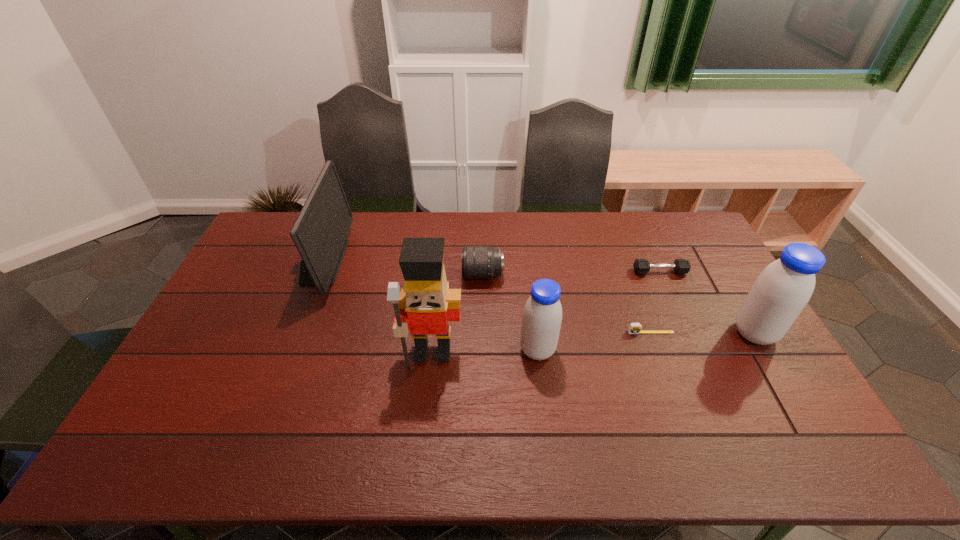
With all soya milks evenly spaced, where should an extra soya milk be placed on the left to continue the pattern? Please point out a vacant space. Please provide its 2D coordinates. Your answer should be formatted as a tuple, i.e. [(x, y)], where the tuple contains the x and y coordinates of a point satisfying the conditions above.

[(304, 368)]